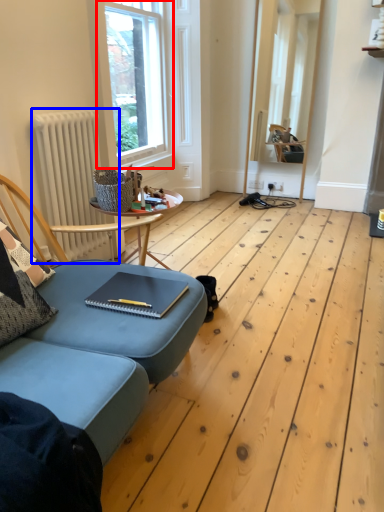
Question: Among these objects, which one is farthest to the camera, window (highlighted by a red box) or radiator (highlighted by a blue box)?

Choices:
 (A) window
 (B) radiator

Answer: (A)